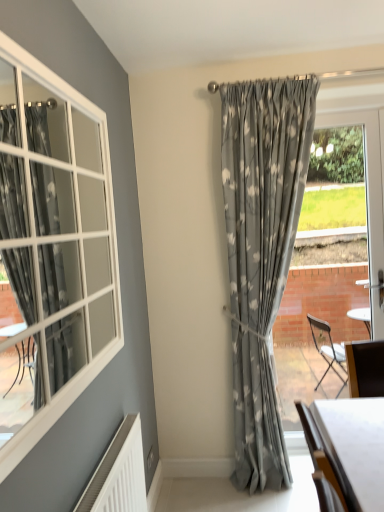
You are a GUI agent. You are given a task and a screenshot of the screen. Output one action in this format:
    pyautogui.click(x=<x>, y=<y>)
    Task: Click on the clear glass door at right
    This screenshot has width=384, height=512.
    Given the screenshot: What is the action you would take?
    pyautogui.click(x=332, y=256)

This screenshot has width=384, height=512. In order to click on window frame located above the white glossy table at lower right (from the image's perspective) in this screenshot , I will do `click(332, 256)`.

Can you tell me how much white glossy table at lower right and clear glass door at right differ in facing direction?

The facing directions of white glossy table at lower right and clear glass door at right are 92.2 degrees apart.

From their relative heights in the image, would you say white glossy table at lower right is taller or shorter than clear glass door at right?

white glossy table at lower right is shorter than clear glass door at right.

Which is more to the right, matte gray curtain at center or clear glass door at right?

clear glass door at right.

Which of these two, matte gray curtain at center or clear glass door at right, is thinner?

clear glass door at right is thinner.

From a real-world perspective, is matte gray curtain at center physically located above or below clear glass door at right?

Clearly, from a real-world perspective, matte gray curtain at center is above clear glass door at right.

Would you say matte gray curtain at center contains clear glass door at right?

No, clear glass door at right is not inside matte gray curtain at center.

How different are the orientations of clear glass door at right and matte gray curtain at center in degrees?

The angular difference between clear glass door at right and matte gray curtain at center is 0.000403 degrees.

Is clear glass door at right not within matte gray curtain at center?

Indeed, clear glass door at right is completely outside matte gray curtain at center.

From the picture: Are clear glass door at right and matte gray curtain at center located far from each other?

Yes.

Which object is more forward, clear glass door at right or matte gray curtain at center?

matte gray curtain at center is in front.

Who is smaller, matte gray curtain at center or white glossy table at lower right?

white glossy table at lower right.

From a real-world perspective, which object stands above the other?

In real-world perspective, matte gray curtain at center is above.

How many degrees apart are the facing directions of matte gray curtain at center and white glossy table at lower right?

They differ by 92.2 degrees in their facing directions.

Based on their sizes in the image, would you say clear glass door at right is bigger or smaller than white glossy table at lower right?

Clearly, clear glass door at right is larger in size than white glossy table at lower right.

Between point (362, 213) and point (327, 441), which one is positioned in front?

Point (327, 441)

Is clear glass door at right aimed at white glossy table at lower right?

Yes, clear glass door at right is facing white glossy table at lower right.

Would you consider clear glass door at right to be distant from white glossy table at lower right?

Absolutely, clear glass door at right is distant from white glossy table at lower right.

Is point (371, 410) positioned behind point (287, 471)?

No, it is not.

Is white glossy table at lower right smaller than matte gray curtain at center?

Indeed, white glossy table at lower right has a smaller size compared to matte gray curtain at center.

How different are the orientations of white glossy table at lower right and matte gray curtain at center in degrees?

The angular difference between white glossy table at lower right and matte gray curtain at center is 92.2 degrees.

Locate an element on the screen. table directly beneath the matte gray curtain at center (from a real-world perspective) is located at coordinates (355, 446).

Find the location of a particular element. This screenshot has height=512, width=384. table that is under the clear glass door at right (from a real-world perspective) is located at coordinates (355, 446).

I want to click on curtain on the left of clear glass door at right, so click(262, 253).

Looking at the image, which one is located closer to clear glass door at right, matte gray curtain at center or white glossy table at lower right?

matte gray curtain at center.

Based on their spatial positions, is clear glass door at right or matte gray curtain at center further from white glossy table at lower right?

Based on the image, clear glass door at right appears to be further to white glossy table at lower right.

Based on their spatial positions, is white glossy table at lower right or clear glass door at right further from matte gray curtain at center?

clear glass door at right.

From the image, which object appears to be nearer to clear glass door at right, white glossy table at lower right or matte gray curtain at center?

matte gray curtain at center lies closer to clear glass door at right than the other object.

From the image, which object appears to be nearer to matte gray curtain at center, clear glass door at right or white glossy table at lower right?

The object closer to matte gray curtain at center is white glossy table at lower right.

Based on their spatial positions, is matte gray curtain at center or clear glass door at right closer to white glossy table at lower right?

matte gray curtain at center lies closer to white glossy table at lower right than the other object.

You are a GUI agent. You are given a task and a screenshot of the screen. Output one action in this format:
    pyautogui.click(x=<x>, y=<y>)
    Task: Click on the curtain located between white glossy table at lower right and clear glass door at right in the depth direction
    The image size is (384, 512).
    Given the screenshot: What is the action you would take?
    pyautogui.click(x=262, y=253)